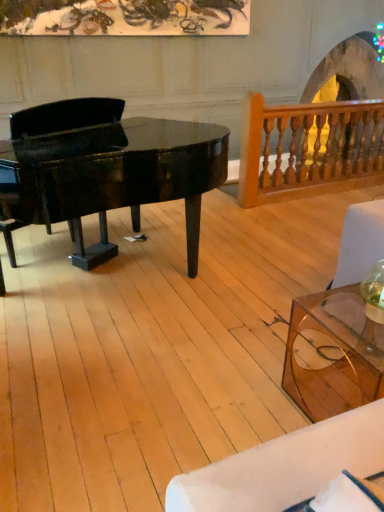
Question: Is wooden baluster at upper right inside glossy black piano at left?

Choices:
 (A) yes
 (B) no

Answer: (B)

Question: Does glossy black piano at left touch wooden baluster at upper right?

Choices:
 (A) no
 (B) yes

Answer: (A)

Question: Considering the relative positions of glossy black piano at left and wooden baluster at upper right in the image provided, is glossy black piano at left to the left of wooden baluster at upper right from the viewer's perspective?

Choices:
 (A) no
 (B) yes

Answer: (B)

Question: Is glossy black piano at left at the right side of wooden baluster at upper right?

Choices:
 (A) yes
 (B) no

Answer: (B)

Question: Considering the relative sizes of glossy black piano at left and wooden baluster at upper right in the image provided, is glossy black piano at left thinner than wooden baluster at upper right?

Choices:
 (A) yes
 (B) no

Answer: (B)

Question: Is point (322, 308) closer or farther from the camera than point (203, 157)?

Choices:
 (A) closer
 (B) farther

Answer: (A)

Question: Do you think transparent glass coffee table at lower right is within glossy black piano at left, or outside of it?

Choices:
 (A) outside
 (B) inside

Answer: (A)

Question: From the image's perspective, relative to glossy black piano at left, is transparent glass coffee table at lower right above or below?

Choices:
 (A) below
 (B) above

Answer: (A)

Question: Considering their positions, is transparent glass coffee table at lower right located in front of or behind glossy black piano at left?

Choices:
 (A) front
 (B) behind

Answer: (A)

Question: Looking at the image, does wooden baluster at upper right seem bigger or smaller compared to glossy black piano at left?

Choices:
 (A) big
 (B) small

Answer: (B)

Question: From a real-world perspective, is wooden baluster at upper right positioned above or below glossy black piano at left?

Choices:
 (A) above
 (B) below

Answer: (B)

Question: Is wooden baluster at upper right to the left or to the right of glossy black piano at left in the image?

Choices:
 (A) left
 (B) right

Answer: (B)

Question: Is point (292, 120) positioned closer to the camera than point (163, 132)?

Choices:
 (A) closer
 (B) farther

Answer: (A)

Question: Choose the correct answer: Is wooden baluster at upper right inside transparent glass coffee table at lower right or outside it?

Choices:
 (A) inside
 (B) outside

Answer: (B)

Question: Considering the positions of wooden baluster at upper right and transparent glass coffee table at lower right in the image, is wooden baluster at upper right wider or thinner than transparent glass coffee table at lower right?

Choices:
 (A) wide
 (B) thin

Answer: (B)